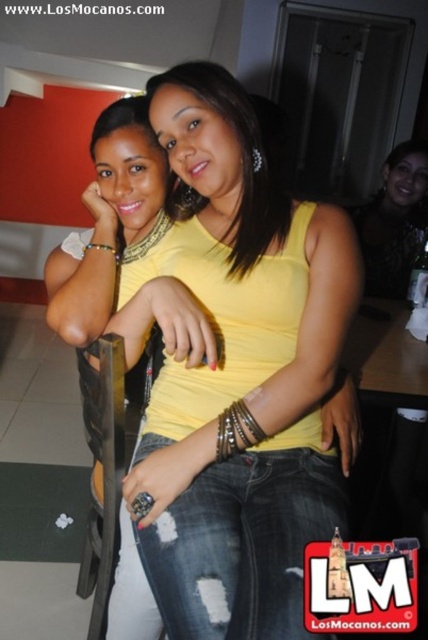
Does ripped denim jeans at center appear on the left side of matte black top at upper right?

Indeed, ripped denim jeans at center is positioned on the left side of matte black top at upper right.

How much distance is there between ripped denim jeans at center and matte black top at upper right?

The distance of ripped denim jeans at center from matte black top at upper right is 1.18 meters.

Is point (107, 198) farther from viewer compared to point (376, 236)?

No, it is in front of (376, 236).

You are a GUI agent. You are given a task and a screenshot of the screen. Output one action in this format:
    pyautogui.click(x=<x>, y=<y>)
    Task: Click on the ripped denim jeans at center
    The image size is (428, 640).
    Given the screenshot: What is the action you would take?
    pyautogui.click(x=121, y=256)

The width and height of the screenshot is (428, 640). Describe the element at coordinates (394, 220) in the screenshot. I see `matte black top at upper right` at that location.

Can you confirm if matte black top at upper right is bigger than metallic black chair at lower left?

Incorrect, matte black top at upper right is not larger than metallic black chair at lower left.

This screenshot has height=640, width=428. I want to click on matte black top at upper right, so click(x=394, y=220).

At what (x,y) coordinates should I click in order to perform the action: click on matte black top at upper right. Please return your answer as a coordinate pair (x, y). Image resolution: width=428 pixels, height=640 pixels. Looking at the image, I should click on (394, 220).

Does yellow matte tank top at center have a larger size compared to metallic black chair at lower left?

Yes.

Does yellow matte tank top at center appear under metallic black chair at lower left?

Actually, yellow matte tank top at center is above metallic black chair at lower left.

Locate an element on the screen. yellow matte tank top at center is located at coordinates click(237, 374).